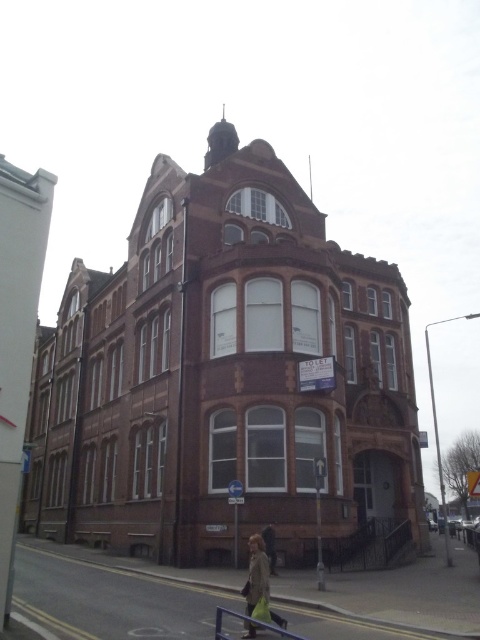
Between light brown leather coat at lower center and metallic gray railing at lower center, which one is positioned higher?

light brown leather coat at lower center is above.

Does point (280, 625) come behind point (264, 624)?

Yes, point (280, 625) is farther from viewer.

Image resolution: width=480 pixels, height=640 pixels. Find the location of `light brown leather coat at lower center`. light brown leather coat at lower center is located at coordinates (256, 573).